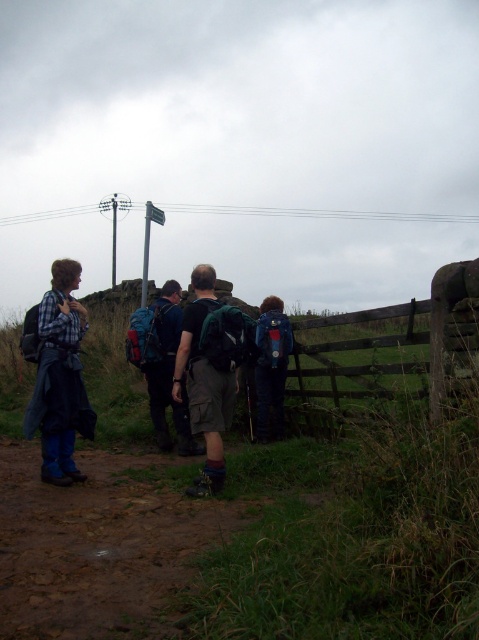
What are the coordinates of `green canvas backpack at center` in the screenshot? It's located at (208, 372).

Who is more forward, (224, 360) or (179, 294)?

Point (224, 360) is in front.

Identify the location of green canvas backpack at center. The image size is (479, 640). (208, 372).

Identify the location of green canvas backpack at center. (208, 372).